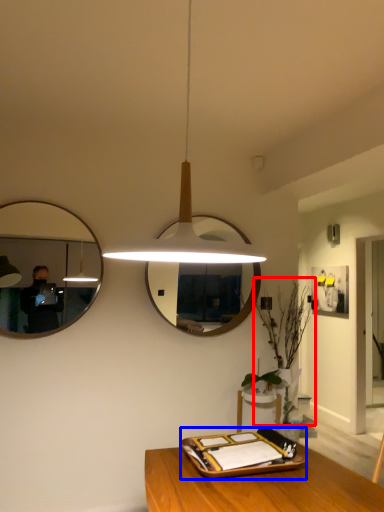
Question: Which point is further to the camera, plant (highlighted by a red box) or tray (highlighted by a blue box)?

Choices:
 (A) plant
 (B) tray

Answer: (A)